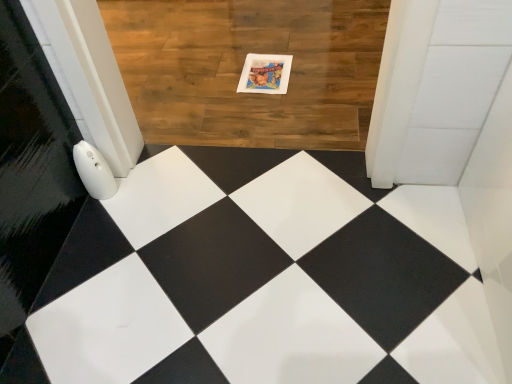
The image size is (512, 384). What do you see at coordinates (265, 74) in the screenshot? I see `matte paper postcard at center` at bounding box center [265, 74].

You are a GUI agent. You are given a task and a screenshot of the screen. Output one action in this format:
    pyautogui.click(x=<x>, y=<y>)
    Task: Click on the matte paper postcard at center
    
    Given the screenshot: What is the action you would take?
    pyautogui.click(x=265, y=74)

The image size is (512, 384). Describe the element at coordinates (242, 68) in the screenshot. I see `wooden floor at center` at that location.

You are a GUI agent. You are given a task and a screenshot of the screen. Output one action in this format:
    pyautogui.click(x=<x>, y=<y>)
    Task: Click on the wooden floor at center
    
    Given the screenshot: What is the action you would take?
    pyautogui.click(x=242, y=68)

You are a GUI agent. You are given a task and a screenshot of the screen. Output one action in this format:
    pyautogui.click(x=<x>, y=<y>)
    Task: Click on the matte paper postcard at center
    The image size is (512, 384).
    Given the screenshot: What is the action you would take?
    pyautogui.click(x=265, y=74)

In the scene shown: In the image, is wooden floor at center on the left side or the right side of matte paper postcard at center?

wooden floor at center is positioned on matte paper postcard at center's left side.

Considering the relative positions of wooden floor at center and matte paper postcard at center in the image provided, is wooden floor at center behind matte paper postcard at center?

No, it is not.

Considering the positions of point (261, 22) and point (247, 73), is point (261, 22) closer or farther from the camera than point (247, 73)?

Point (261, 22) is farther from the camera than point (247, 73).

From the image's perspective, which is above, wooden floor at center or matte paper postcard at center?

wooden floor at center, from the image's perspective.

From a real-world perspective, does wooden floor at center stand above matte paper postcard at center?

No.

Which object is thinner, wooden floor at center or matte paper postcard at center?

Thinner between the two is matte paper postcard at center.

Based on the photo, which of these two, wooden floor at center or matte paper postcard at center, stands shorter?

matte paper postcard at center is shorter.

Is wooden floor at center smaller than matte paper postcard at center?

No, wooden floor at center is not smaller than matte paper postcard at center.

Can we say wooden floor at center lies outside matte paper postcard at center?

Indeed, wooden floor at center is completely outside matte paper postcard at center.

From the picture: Is wooden floor at center not near matte paper postcard at center?

No, wooden floor at center is not far away from matte paper postcard at center.

Is wooden floor at center facing away from matte paper postcard at center?

Yes, wooden floor at center's orientation is away from matte paper postcard at center.

Can you tell me how much wooden floor at center and matte paper postcard at center differ in facing direction?

There is a 0.000249-degree angle between the facing directions of wooden floor at center and matte paper postcard at center.

Where is `square below the matte paper postcard at center (from a real-world perspective)`? This screenshot has height=384, width=512. square below the matte paper postcard at center (from a real-world perspective) is located at coordinates (242, 68).

Considering the relative positions of matte paper postcard at center and wooden floor at center in the image provided, is matte paper postcard at center to the left or to the right of wooden floor at center?

matte paper postcard at center is positioned on wooden floor at center's right side.

Does matte paper postcard at center lie behind wooden floor at center?

Yes.

Does point (290, 64) appear closer or farther from the camera than point (254, 124)?

Point (290, 64).

From the image's perspective, which one is positioned higher, matte paper postcard at center or wooden floor at center?

wooden floor at center appears higher in the image.

From a real-world perspective, between matte paper postcard at center and wooden floor at center, who is vertically lower?

wooden floor at center is physically lower.

Which object is thinner, matte paper postcard at center or wooden floor at center?

matte paper postcard at center is thinner.

Does matte paper postcard at center have a lesser height compared to wooden floor at center?

Correct, matte paper postcard at center is not as tall as wooden floor at center.

Who is bigger, matte paper postcard at center or wooden floor at center?

wooden floor at center is bigger.

Does matte paper postcard at center contain wooden floor at center?

No, wooden floor at center is not inside matte paper postcard at center.

Is matte paper postcard at center placed right next to wooden floor at center?

matte paper postcard at center is not next to wooden floor at center, and they're not touching.

Is matte paper postcard at center looking in the opposite direction of wooden floor at center?

Yes.

Locate an element on the screen. The height and width of the screenshot is (384, 512). square above the matte paper postcard at center (from the image's perspective) is located at coordinates (242, 68).

Find the location of a particular element. postcard located on the right of wooden floor at center is located at coordinates (265, 74).

The width and height of the screenshot is (512, 384). Find the location of `postcard lying below the wooden floor at center (from the image's perspective)`. postcard lying below the wooden floor at center (from the image's perspective) is located at coordinates (265, 74).